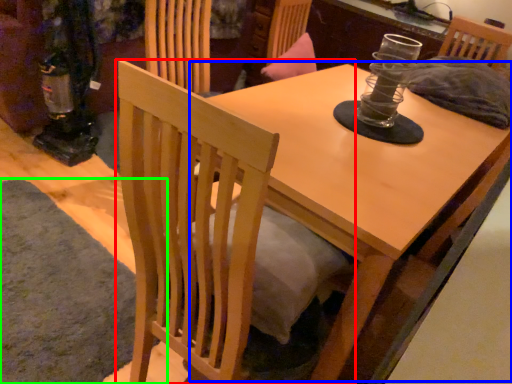
Question: Which object is the farthest from chair (highlighted by a red box)? Choose among these: round table (highlighted by a blue box) or mat (highlighted by a green box).

Choices:
 (A) round table
 (B) mat

Answer: (B)